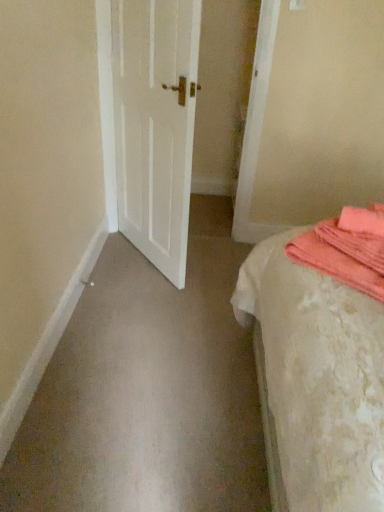
Question: Is white matte door at center wider or thinner than white textured bed at right?

Choices:
 (A) thin
 (B) wide

Answer: (A)

Question: Considering the positions of white matte door at center and white textured bed at right in the image, is white matte door at center bigger or smaller than white textured bed at right?

Choices:
 (A) small
 (B) big

Answer: (A)

Question: Which object is the farthest from the white textured bed at right?

Choices:
 (A) white matte door at center
 (B) coral soft towel at right

Answer: (A)

Question: Which is nearer to the coral soft towel at right?

Choices:
 (A) white textured bed at right
 (B) white matte door at center

Answer: (A)